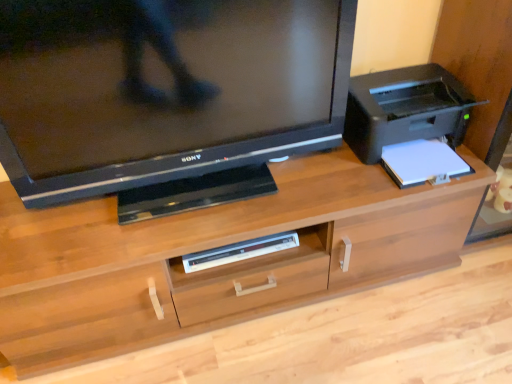
Where is `free area below matte black television at upper left (from a real-world perspective)`? The height and width of the screenshot is (384, 512). free area below matte black television at upper left (from a real-world perspective) is located at coordinates (x=195, y=194).